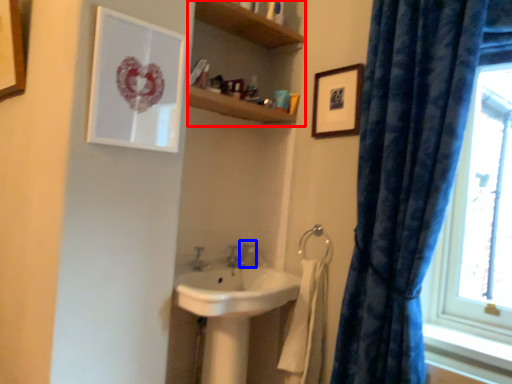
Question: Which object appears closest to the camera in this image, bookshelf (highlighted by a red box) or plumbing fixture (highlighted by a blue box)?

Choices:
 (A) bookshelf
 (B) plumbing fixture

Answer: (A)